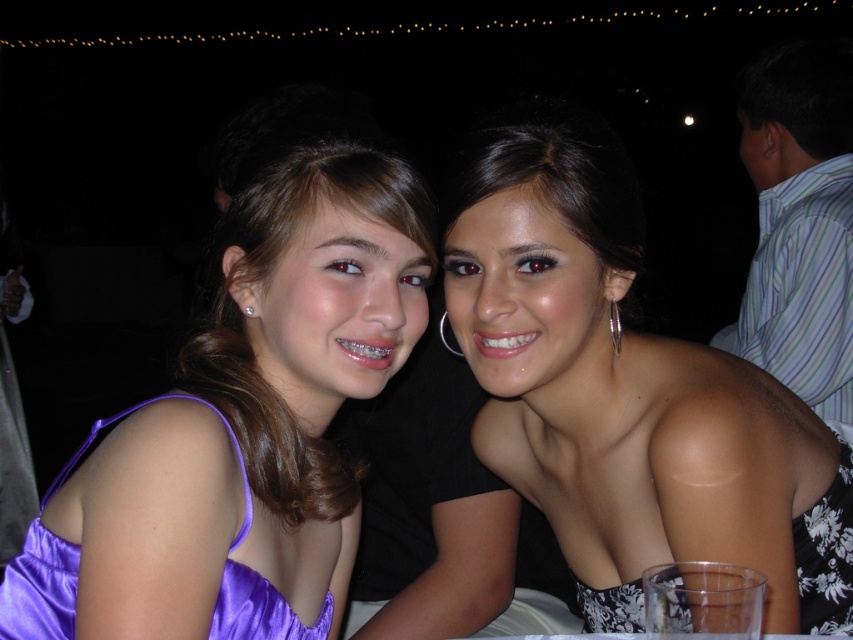
Question: Is black satin dress at center further to camera compared to purple satin dress at left?

Choices:
 (A) no
 (B) yes

Answer: (B)

Question: Does satin purple dress at left have a larger size compared to purple satin dress at left?

Choices:
 (A) no
 (B) yes

Answer: (A)

Question: Among these points, which one is nearest to the camera?

Choices:
 (A) (x=120, y=458)
 (B) (x=10, y=573)

Answer: (A)

Question: Which point appears farthest from the camera in this image?

Choices:
 (A) (628, 500)
 (B) (41, 632)

Answer: (A)

Question: Is satin purple dress at left thinner than black satin dress at center?

Choices:
 (A) no
 (B) yes

Answer: (B)

Question: Which point is farther to the camera?

Choices:
 (A) purple satin dress at left
 (B) black satin dress at center
 (C) satin purple dress at left

Answer: (B)